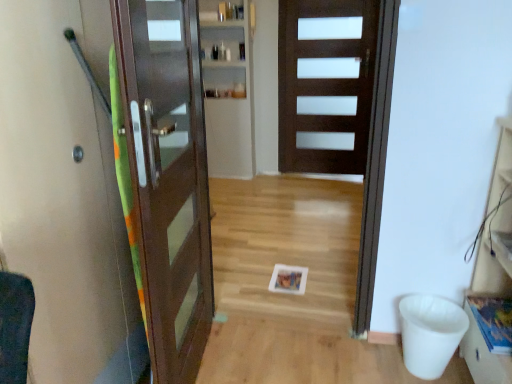
The height and width of the screenshot is (384, 512). I want to click on dark wood door at center, arranged as the 2th door when viewed from the left, so click(326, 84).

Locate an element on the screen. green fabric elevator at left is located at coordinates (65, 195).

At what (x,y) coordinates should I click in order to perform the action: click on dark wood door at center, acting as the first door starting from the back. Please return your answer as a coordinate pair (x, y). Looking at the image, I should click on (326, 84).

From a real-world perspective, is wooden drawer at lower right physically located above or below dark wood door at center, placed as the 2th door when sorted from front to back?

wooden drawer at lower right is below dark wood door at center, placed as the 2th door when sorted from front to back.

From the image's perspective, is wooden drawer at lower right above or below dark wood door at center, positioned as the 1th door in right-to-left order?

Based on their image positions, wooden drawer at lower right is located beneath dark wood door at center, positioned as the 1th door in right-to-left order.

Considering the sizes of wooden drawer at lower right and dark wood door at center, acting as the first door starting from the back, in the image, is wooden drawer at lower right bigger or smaller than dark wood door at center, acting as the first door starting from the back,?

Considering their sizes, wooden drawer at lower right takes up less space than dark wood door at center, acting as the first door starting from the back.

Considering the sizes of objects wooden drawer at lower right and dark wood door at center, arranged as the 2th door when viewed from the left, in the image provided, who is taller, wooden drawer at lower right or dark wood door at center, arranged as the 2th door when viewed from the left,?

Standing taller between the two is dark wood door at center, arranged as the 2th door when viewed from the left.

Which is more to the left, matte brown door at left, placed as the second door when sorted from back to front, or green fabric elevator at left?

From the viewer's perspective, green fabric elevator at left appears more on the left side.

Is matte brown door at left, which is the 2th door in right-to-left order, looking in the opposite direction of green fabric elevator at left?

No.

From the image's perspective, which is below, matte brown door at left, placed as the second door when sorted from back to front, or green fabric elevator at left?

green fabric elevator at left appears lower in the image.

From a real-world perspective, is matte brown door at left, which is the 2th door in right-to-left order, positioned over green fabric elevator at left based on gravity?

Incorrect, from a real-world perspective, matte brown door at left, which is the 2th door in right-to-left order, is lower than green fabric elevator at left.

Which object is further away from the camera taking this photo, wooden drawer at lower right or green fabric elevator at left?

wooden drawer at lower right is further away from the camera.

Looking at this image, which of these two, wooden drawer at lower right or green fabric elevator at left, is thinner?

wooden drawer at lower right.

Does dark wood door at center, acting as the first door starting from the back, turn towards wooden drawer at lower right?

Yes, dark wood door at center, acting as the first door starting from the back, faces towards wooden drawer at lower right.

From the image's perspective, is dark wood door at center, acting as the first door starting from the back, located above or below wooden drawer at lower right?

dark wood door at center, acting as the first door starting from the back, is situated higher than wooden drawer at lower right in the image.

Between dark wood door at center, positioned as the 1th door in right-to-left order, and wooden drawer at lower right, which one has more height?

dark wood door at center, positioned as the 1th door in right-to-left order, is taller.

Is dark wood door at center, acting as the first door starting from the back, placed right next to wooden drawer at lower right?

No, dark wood door at center, acting as the first door starting from the back, is not touching wooden drawer at lower right.

From the image's perspective, which object appears higher, dark wood door at center, acting as the first door starting from the back, or matte brown door at left, which is the 2th door in right-to-left order?

dark wood door at center, acting as the first door starting from the back, from the image's perspective.

Does dark wood door at center, arranged as the 2th door when viewed from the left, have a larger size compared to matte brown door at left, which is counted as the first door, starting from the front?

Yes, dark wood door at center, arranged as the 2th door when viewed from the left, is bigger than matte brown door at left, which is counted as the first door, starting from the front.

Between dark wood door at center, placed as the 2th door when sorted from front to back, and matte brown door at left, placed as the second door when sorted from back to front, which one has smaller width?

dark wood door at center, placed as the 2th door when sorted from front to back.

Is matte brown door at left, placed as the 1th door when sorted from left to right, closer to the viewer compared to wooden drawer at lower right?

Yes, it is.

Looking at this image, does matte brown door at left, which is the 2th door in right-to-left order, have a lesser width compared to wooden drawer at lower right?

In fact, matte brown door at left, which is the 2th door in right-to-left order, might be wider than wooden drawer at lower right.

From the picture: From a real-world perspective, which is physically above, matte brown door at left, placed as the second door when sorted from back to front, or wooden drawer at lower right?

matte brown door at left, placed as the second door when sorted from back to front.

Can you tell me how much green fabric elevator at left and dark wood door at center, acting as the first door starting from the back, differ in facing direction?

They differ by 91.5 degrees in their facing directions.

Can you confirm if green fabric elevator at left is taller than dark wood door at center, acting as the first door starting from the back?

No.

Is green fabric elevator at left positioned with its back to dark wood door at center, arranged as the 2th door when viewed from the left?

No, green fabric elevator at left is not facing the opposite direction of dark wood door at center, arranged as the 2th door when viewed from the left.

Does green fabric elevator at left have a greater width compared to dark wood door at center, arranged as the 2th door when viewed from the left?

Yes.

From the image's perspective, count 2nd doors upward from the wooden drawer at lower right and point to it. Please provide its 2D coordinates.

[(326, 84)]

This screenshot has height=384, width=512. What are the coordinates of `elevator above the matte brown door at left, which is the 2th door in right-to-left order (from a real-world perspective)` in the screenshot? It's located at (65, 195).

Based on their spatial positions, is matte brown door at left, placed as the second door when sorted from back to front, or wooden drawer at lower right further from dark wood door at center, placed as the 2th door when sorted from front to back?

wooden drawer at lower right lies further to dark wood door at center, placed as the 2th door when sorted from front to back, than the other object.

From the picture: Considering their positions, is dark wood door at center, positioned as the 1th door in right-to-left order, positioned further to green fabric elevator at left than matte brown door at left, which is counted as the first door, starting from the front?

Based on the image, dark wood door at center, positioned as the 1th door in right-to-left order, appears to be further to green fabric elevator at left.

From the image, which object appears to be nearer to green fabric elevator at left, matte brown door at left, which is the 2th door in right-to-left order, or wooden drawer at lower right?

matte brown door at left, which is the 2th door in right-to-left order, lies closer to green fabric elevator at left than the other object.

Which object lies further to the anchor point wooden drawer at lower right, matte brown door at left, placed as the second door when sorted from back to front, or dark wood door at center, placed as the 2th door when sorted from front to back?

dark wood door at center, placed as the 2th door when sorted from front to back.

Looking at the image, which one is located further to wooden drawer at lower right, green fabric elevator at left or matte brown door at left, placed as the second door when sorted from back to front?

green fabric elevator at left is positioned further to the anchor wooden drawer at lower right.

Estimate the real-world distances between objects in this image. Which object is further from wooden drawer at lower right, matte brown door at left, placed as the 1th door when sorted from left to right, or green fabric elevator at left?

Among the two, green fabric elevator at left is located further to wooden drawer at lower right.

Based on their spatial positions, is green fabric elevator at left or dark wood door at center, placed as the 2th door when sorted from front to back, further from matte brown door at left, which is the 2th door in right-to-left order?

Based on the image, dark wood door at center, placed as the 2th door when sorted from front to back, appears to be further to matte brown door at left, which is the 2th door in right-to-left order.

Considering their positions, is wooden drawer at lower right positioned further to dark wood door at center, positioned as the 1th door in right-to-left order, than green fabric elevator at left?

Based on the image, green fabric elevator at left appears to be further to dark wood door at center, positioned as the 1th door in right-to-left order.

Where is `drawer located between green fabric elevator at left and dark wood door at center, acting as the first door starting from the back, in the depth direction`? Image resolution: width=512 pixels, height=384 pixels. drawer located between green fabric elevator at left and dark wood door at center, acting as the first door starting from the back, in the depth direction is located at coordinates (483, 357).

Where is `door between green fabric elevator at left and dark wood door at center, arranged as the 2th door when viewed from the left, along the z-axis`? door between green fabric elevator at left and dark wood door at center, arranged as the 2th door when viewed from the left, along the z-axis is located at coordinates (168, 177).

What are the coordinates of `drawer positioned between matte brown door at left, which is counted as the first door, starting from the front, and dark wood door at center, positioned as the 1th door in right-to-left order, from near to far` in the screenshot? It's located at (483, 357).